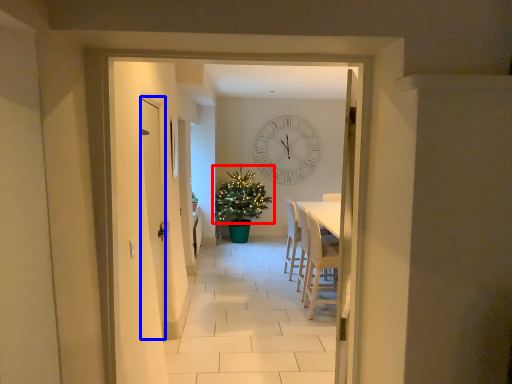
Question: Which point is closer to the camera, christmas tree (highlighted by a red box) or door (highlighted by a blue box)?

Choices:
 (A) christmas tree
 (B) door

Answer: (B)